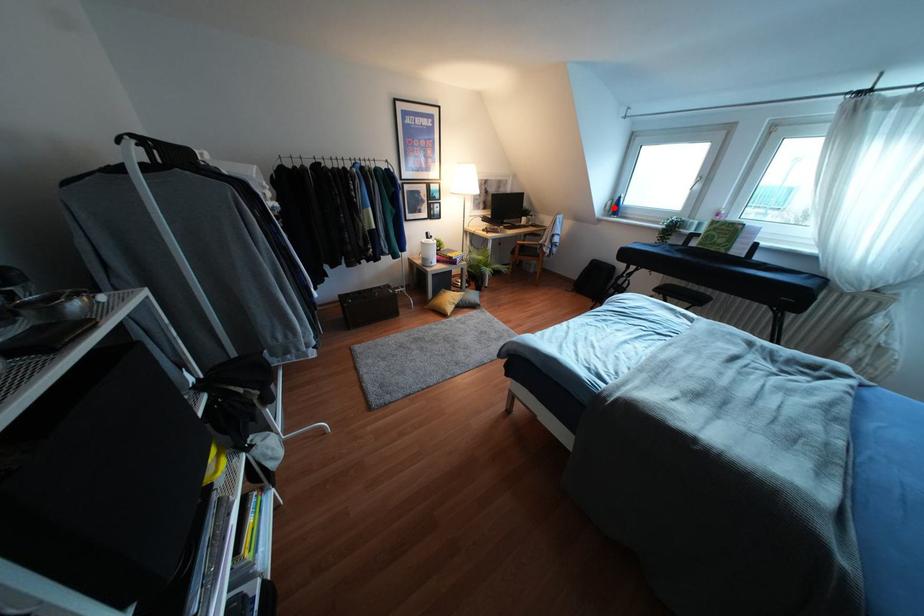
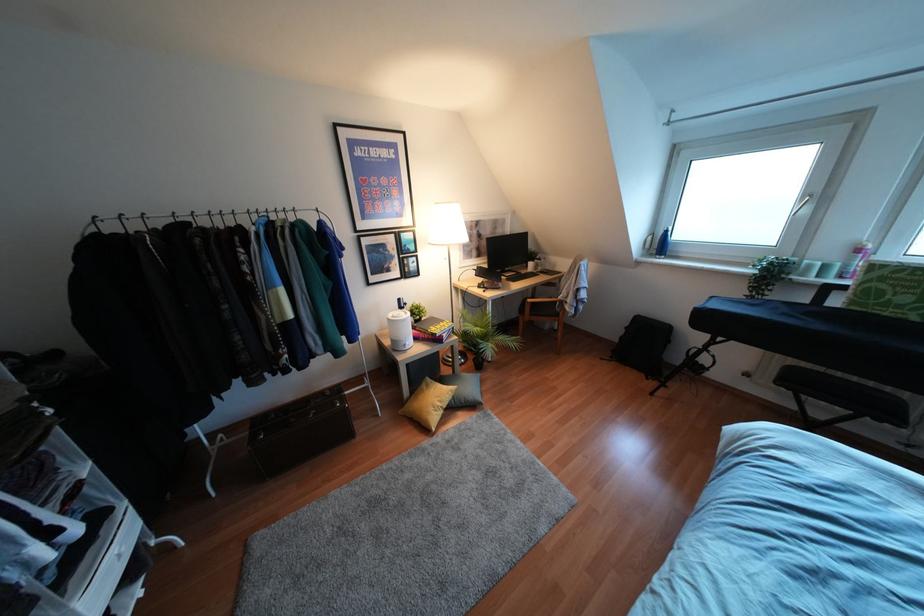
The point at the highlighted location is marked in the first image. Where is the corresponding point in the second image?

(660, 245)